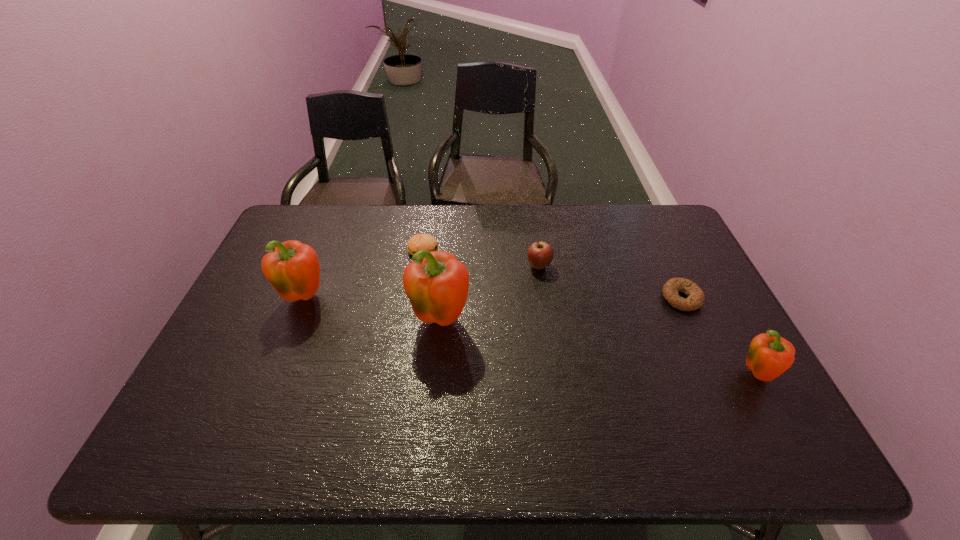
Where is `the leftmost object`? The height and width of the screenshot is (540, 960). the leftmost object is located at coordinates (292, 267).

Locate an element on the screen. The width and height of the screenshot is (960, 540). the leftmost pepper is located at coordinates pyautogui.click(x=292, y=267).

The height and width of the screenshot is (540, 960). What are the coordinates of `the second pepper from right to left` in the screenshot? It's located at (436, 283).

At what (x,y) coordinates should I click in order to perform the action: click on the third tallest object. Please return your answer as a coordinate pair (x, y). The height and width of the screenshot is (540, 960). Looking at the image, I should click on (768, 357).

The height and width of the screenshot is (540, 960). Find the location of `the nearest pepper`. the nearest pepper is located at coordinates (768, 357).

The width and height of the screenshot is (960, 540). What are the coordinates of `the fifth tallest object` in the screenshot? It's located at (418, 242).

This screenshot has height=540, width=960. Find the location of `the shortest object`. the shortest object is located at coordinates (695, 299).

Find the location of a particular element. Image resolution: width=960 pixels, height=540 pixels. apple is located at coordinates (540, 254).

Find the location of a particular element. This screenshot has width=960, height=540. the third object from right to left is located at coordinates (540, 254).

The height and width of the screenshot is (540, 960). In order to click on vacant space located 0.190m on the right of the leftmost pepper in this screenshot , I will do `click(396, 298)`.